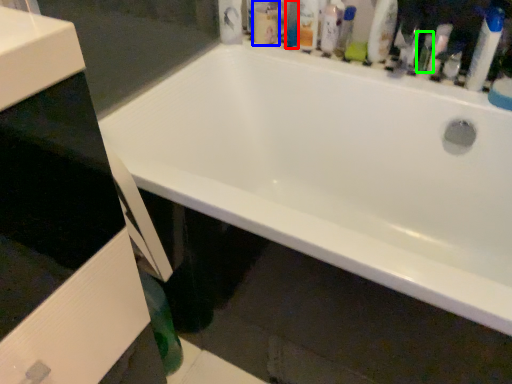
Question: Estimate the real-world distances between objects in this image. Which object is closer to mouthwash (highlighted by a red box), mouthwash (highlighted by a blue box) or toiletry (highlighted by a green box)?

Choices:
 (A) mouthwash
 (B) toiletry

Answer: (A)